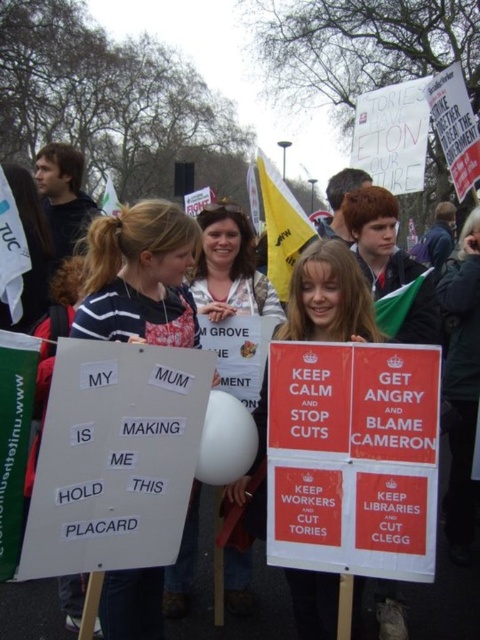
Question: Does matte white sign at center have a smaller size compared to white paper sign at center?

Choices:
 (A) no
 (B) yes

Answer: (B)

Question: Which of the following is the farthest from the observer?

Choices:
 (A) (311, 579)
 (B) (179, 344)
 (C) (206, 298)

Answer: (C)

Question: Considering the real-world distances, which object is farthest from the matte white sign at center?

Choices:
 (A) white paper placard at center
 (B) white paper sign at center

Answer: (B)

Question: Is matte white sign at center thinner than white paper sign at center?

Choices:
 (A) yes
 (B) no

Answer: (A)

Question: Which point is farther from the camera taking this photo?

Choices:
 (A) (237, 257)
 (B) (168, 250)
 (C) (265, 371)

Answer: (A)

Question: Does matte white sign at center appear under white paper sign at center?

Choices:
 (A) no
 (B) yes

Answer: (B)